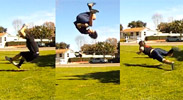
The width and height of the screenshot is (183, 100). What are the coordinates of `right side window` in the screenshot? It's located at (136, 32).